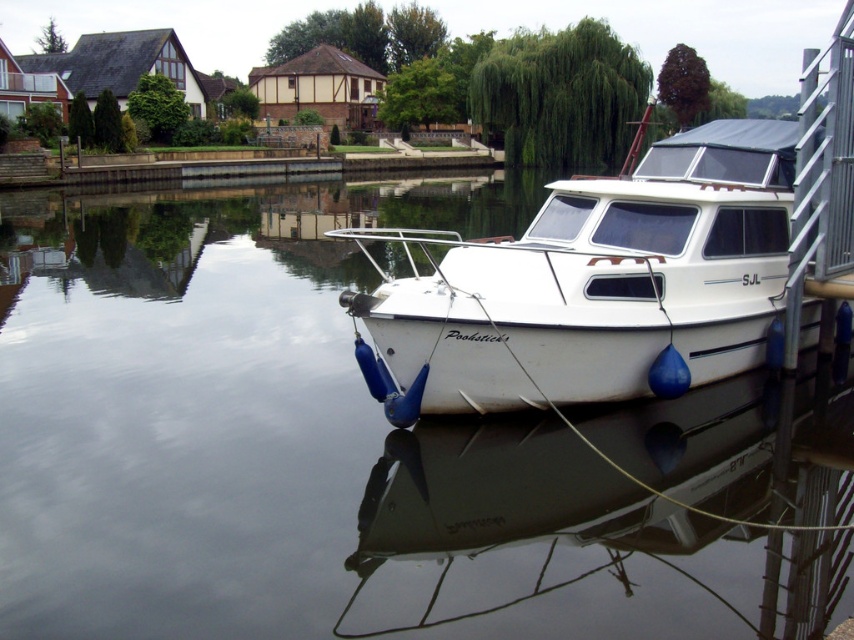
Is point (215, 541) more distant than point (670, 195)?

No, it is not.

Does smooth water at boat right have a greater width compared to white matte boat at right?

Yes, smooth water at boat right is wider than white matte boat at right.

Describe the element at coordinates (314, 451) in the screenshot. I see `smooth water at boat right` at that location.

This screenshot has width=854, height=640. What are the coordinates of `smooth water at boat right` in the screenshot? It's located at (314, 451).